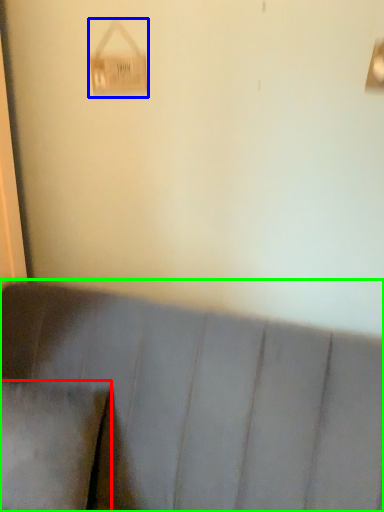
Question: Which object is the farthest from pillow (highlighted by a red box)? Choose among these: lamp (highlighted by a blue box) or furniture (highlighted by a green box).

Choices:
 (A) lamp
 (B) furniture

Answer: (A)